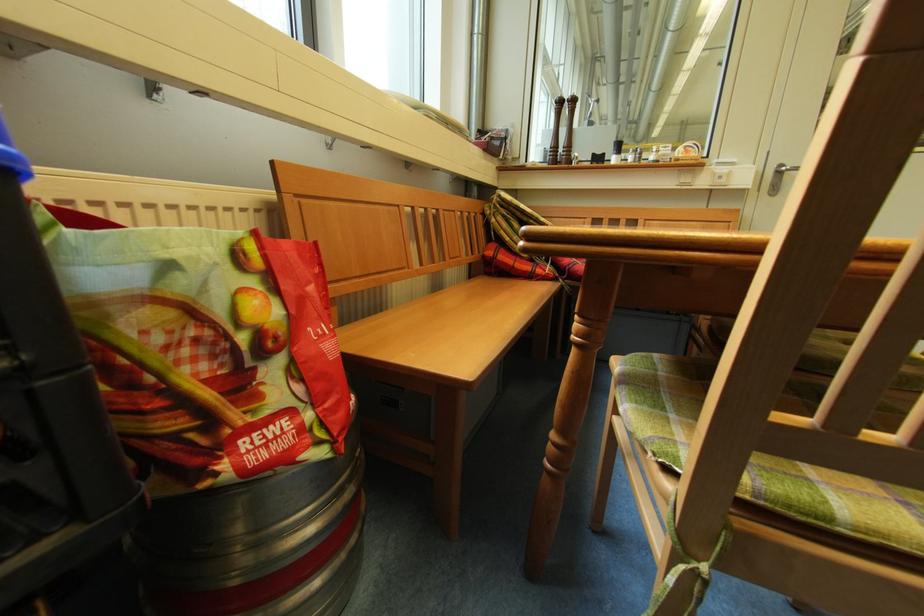
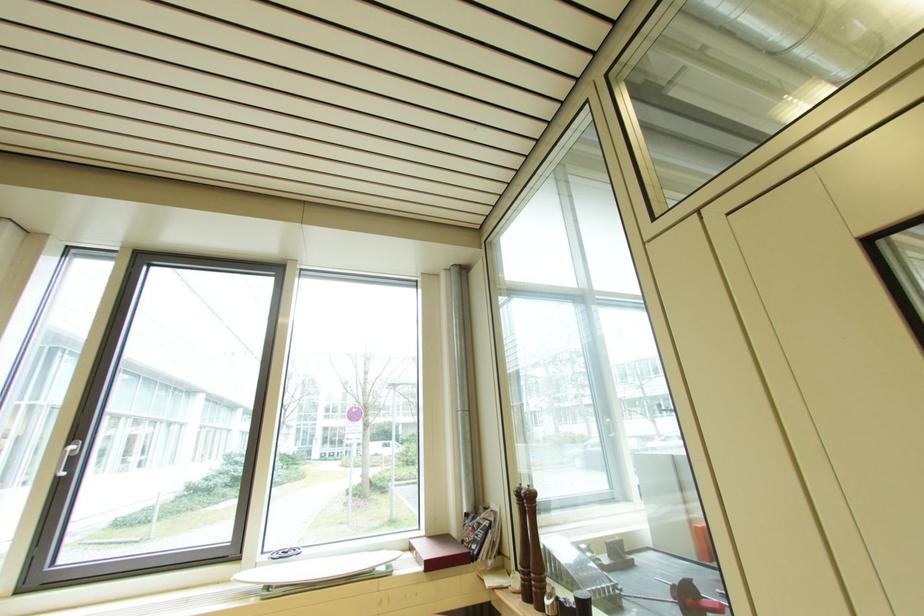
In the second image, find the point that corresponds to pixel 564 105 in the first image.

(524, 498)